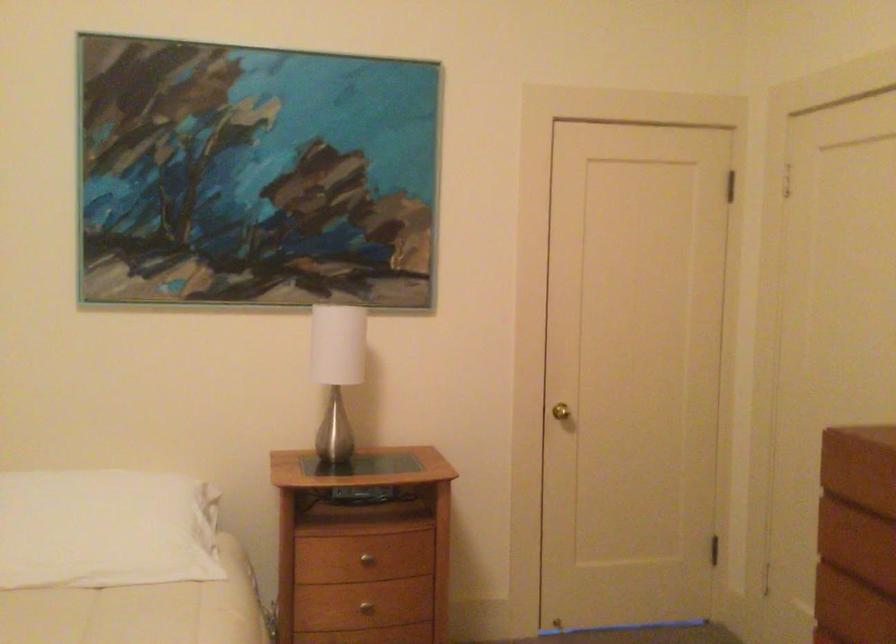
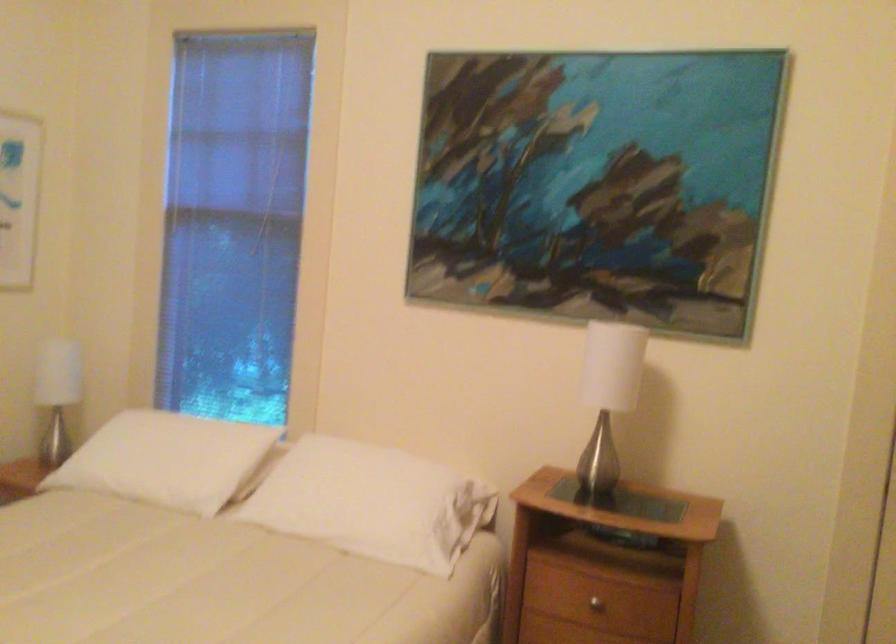
Find the pixel in the second image that matches point (342, 374) in the first image.

(607, 397)